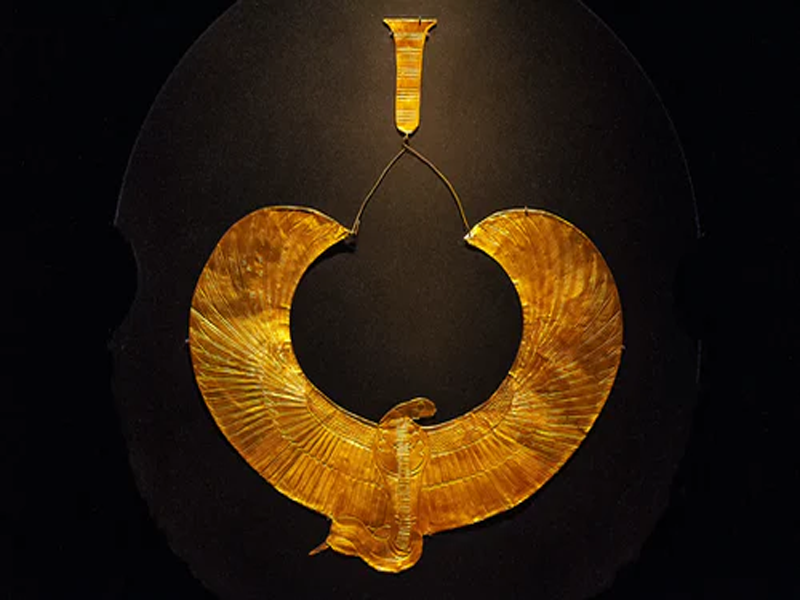
Image resolution: width=800 pixels, height=600 pixels. I want to click on art piece, so click(533, 436).